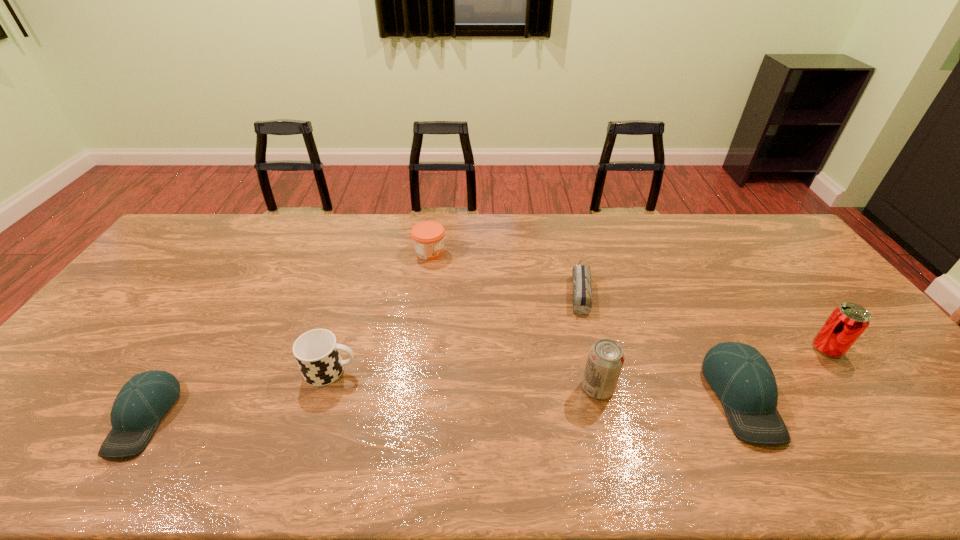
The height and width of the screenshot is (540, 960). I want to click on vacant space that satisfies the following two spatial constraints: 1. on the side of the cup with the handle; 2. on the right side of the right baseball cap, so click(323, 397).

Identify the location of vacant space that satisfies the following two spatial constraints: 1. on the back side of the farther soda can; 2. on the left side of the right baseball cap. This screenshot has width=960, height=540. (717, 349).

What are the coordinates of `vacant space that satisfies the following two spatial constraints: 1. on the back side of the taller baseball cap; 2. on the side of the second object from left to right with the handle` in the screenshot? It's located at (x=728, y=370).

Identify the location of vacant space that satisfies the following two spatial constraints: 1. on the back side of the nearer soda can; 2. on the side of the second object from left to right with the handle. The image size is (960, 540). (593, 370).

You are a GUI agent. You are given a task and a screenshot of the screen. Output one action in this format:
    pyautogui.click(x=<x>, y=<y>)
    Task: Click on the blank space that satisfies the following two spatial constraints: 1. on the front label of the jam; 2. on the right side of the taller baseball cap
    Image resolution: width=960 pixels, height=540 pixels.
    Given the screenshot: What is the action you would take?
    pyautogui.click(x=410, y=397)

The width and height of the screenshot is (960, 540). Identify the location of vacant point that satisfies the following two spatial constraints: 1. on the front label of the second object from right to left; 2. on the left side of the fifth object from right to left. (410, 397).

The height and width of the screenshot is (540, 960). Identify the location of free space that satisfies the following two spatial constraints: 1. on the side of the cup with the handle; 2. on the back side of the left soda can. (325, 388).

The height and width of the screenshot is (540, 960). Find the location of `vacant space that satisfies the following two spatial constraints: 1. on the back side of the left baseball cap; 2. on the right side of the right baseball cap`. vacant space that satisfies the following two spatial constraints: 1. on the back side of the left baseball cap; 2. on the right side of the right baseball cap is located at coordinates (156, 397).

Image resolution: width=960 pixels, height=540 pixels. I want to click on vacant space that satisfies the following two spatial constraints: 1. on the front side of the shortest object; 2. on the right side of the taller baseball cap, so click(x=606, y=397).

At what (x,y) coordinates should I click in order to perform the action: click on vacant region that satisfies the following two spatial constraints: 1. on the back side of the left baseball cap; 2. on the left side of the left soda can. Please return your answer as a coordinate pair (x, y). Looking at the image, I should click on (162, 388).